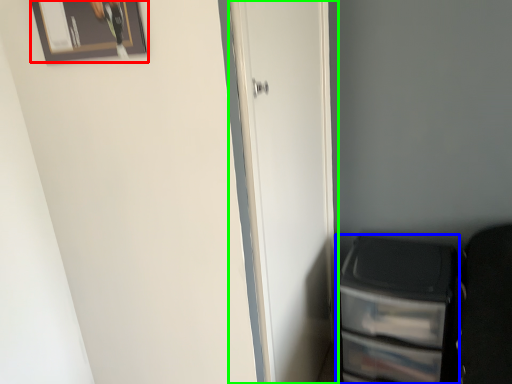
Question: Considering the real-world distances, which object is farthest from picture frame (highlighted by a red box)? file cabinet (highlighted by a blue box) or door (highlighted by a green box)?

Choices:
 (A) file cabinet
 (B) door

Answer: (A)